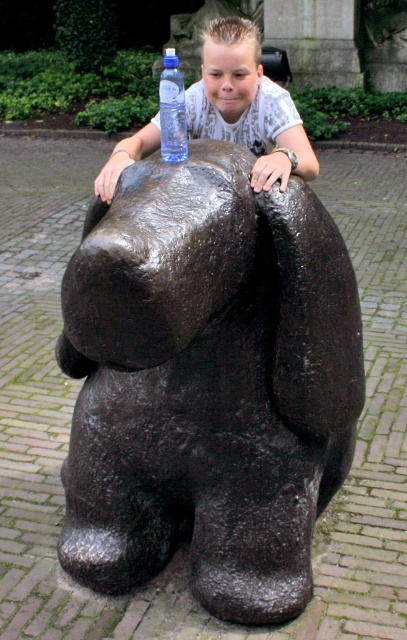
Question: Which point is closer to the camera taking this photo?

Choices:
 (A) (164, 125)
 (B) (260, 141)

Answer: (A)

Question: Which point is farther to the camera?

Choices:
 (A) black polished stone bear at center
 (B) transparent plastic bottle at upper center

Answer: (B)

Question: Is smooth blue water bottle at upper center thinner than transparent plastic bottle at upper center?

Choices:
 (A) yes
 (B) no

Answer: (B)

Question: Does black polished stone bear at center appear on the left side of smooth blue water bottle at upper center?

Choices:
 (A) yes
 (B) no

Answer: (B)

Question: Is black polished stone bear at center further to camera compared to smooth blue water bottle at upper center?

Choices:
 (A) no
 (B) yes

Answer: (A)

Question: Which point is farther from the camera taking this photo?

Choices:
 (A) (177, 61)
 (B) (203, 33)
 (C) (260, 426)

Answer: (B)